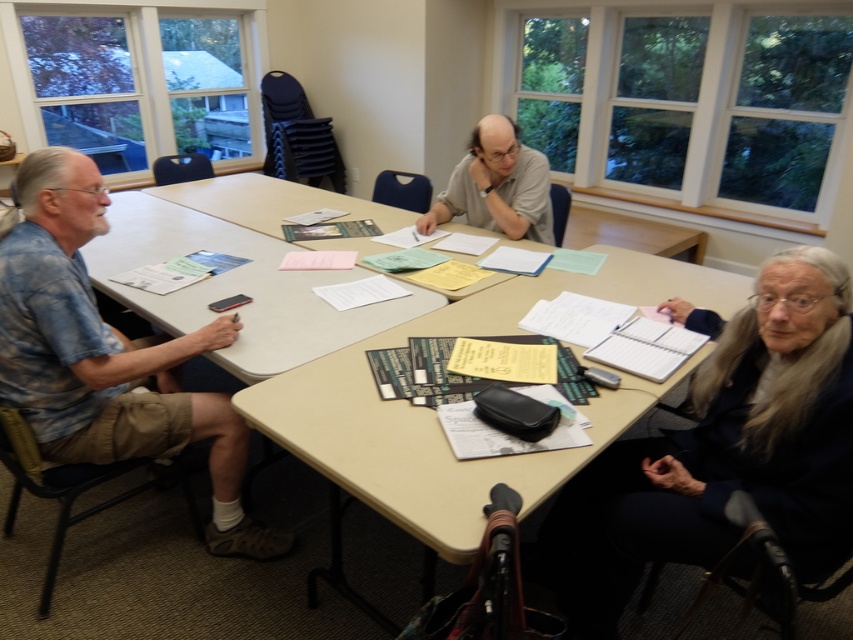
Does blue tie-dye shirt at left lie behind matte gray shirt at center?

No, blue tie-dye shirt at left is closer to the viewer.

Does point (160, 360) come farther from viewer compared to point (531, 198)?

No, (160, 360) is closer to viewer.

You are a GUI agent. You are given a task and a screenshot of the screen. Output one action in this format:
    pyautogui.click(x=<x>, y=<y>)
    Task: Click on the blue tie-dye shirt at left
    This screenshot has height=640, width=853.
    Given the screenshot: What is the action you would take?
    pyautogui.click(x=105, y=353)

Does dark blue sweater at lower right appear under matte gray shirt at center?

Yes, dark blue sweater at lower right is below matte gray shirt at center.

Does point (641, 513) lie behind point (495, 164)?

No, (641, 513) is in front of (495, 164).

Is point (837, 442) closer to viewer compared to point (521, 218)?

That is True.

The image size is (853, 640). I want to click on dark blue sweater at lower right, so click(721, 451).

Is dark blue sweater at lower right further to the viewer compared to blue tie-dye shirt at left?

No, it is in front of blue tie-dye shirt at left.

Can you confirm if dark blue sweater at lower right is positioned to the right of blue tie-dye shirt at left?

Indeed, dark blue sweater at lower right is positioned on the right side of blue tie-dye shirt at left.

Between point (788, 484) and point (154, 355), which one is positioned in front?

Positioned in front is point (788, 484).

I want to click on dark blue sweater at lower right, so click(721, 451).